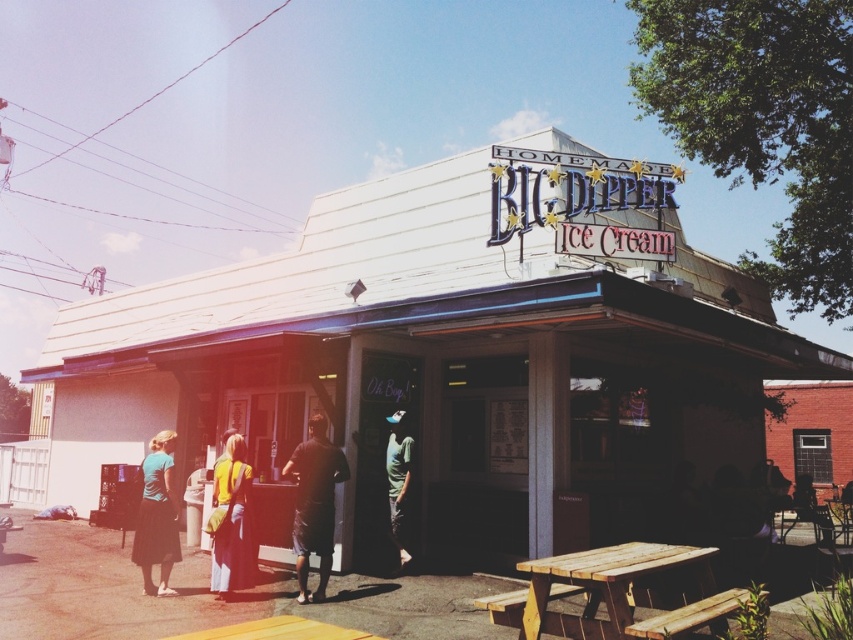
Question: Does white corrugated metal building at center appear on the left side of yellow fabric backpack at center?

Choices:
 (A) yes
 (B) no

Answer: (A)

Question: Is the position of white corrugated metal building at center less distant than that of yellow fabric backpack at center?

Choices:
 (A) no
 (B) yes

Answer: (B)

Question: Estimate the real-world distances between objects in this image. Which object is farther from the yellow fabric backpack at center?

Choices:
 (A) black matte shirt at center
 (B) white corrugated metal building at center

Answer: (B)

Question: Where is wooden picnic table at lower right located in relation to green cotton shirt at center in the image?

Choices:
 (A) below
 (B) above

Answer: (A)

Question: Which object appears closest to the camera in this image?

Choices:
 (A) black matte shirt at center
 (B) white corrugated metal building at center
 (C) yellow fabric backpack at center
 (D) dark blue jeans at lower right

Answer: (B)

Question: Which point is closer to the camera taking this photo?

Choices:
 (A) (714, 618)
 (B) (161, 545)

Answer: (A)